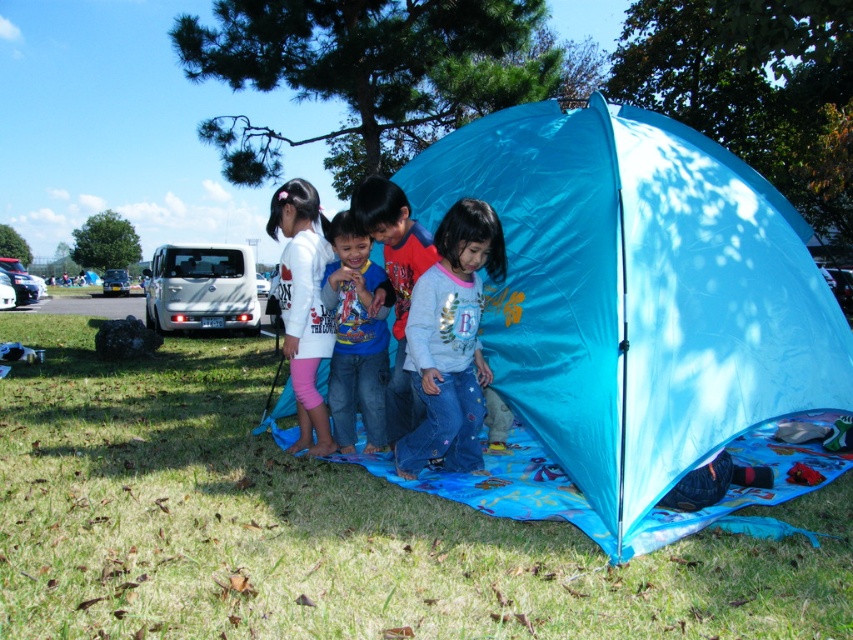
You are a photographer taking a picture of the light blue denim pants at center and the blue cotton shirt at center. Which object should you focus on first if you want to capture both in the same frame without moving the camera?

You should focus on the light blue denim pants at center first because it is much taller than the blue cotton shirt at center, ensuring both are in frame without needing to adjust the camera position.

You are a photographer trying to capture a photo of the children at the tent. You notice the light blue denim pants at center and the white matte shirt at center. Which clothing item is located to the right of the other?

The light blue denim pants at center is positioned on the right side of white matte shirt at center.

You are a photographer taking a picture of the children at the tent. You notice the light blue denim pants at center and the blue cotton shirt at center. Which clothing item is lower in the image?

The light blue denim pants at center is located below blue cotton shirt at center, so the light blue denim pants at center is lower in the image.